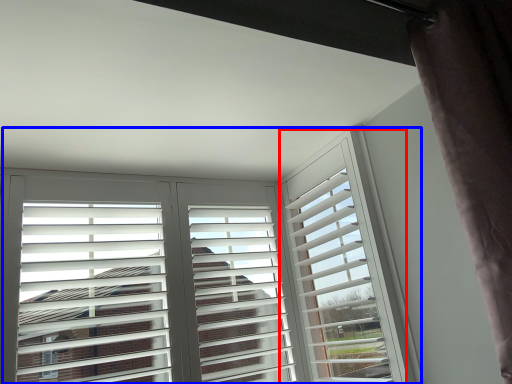
Question: Which object appears farthest to the camera in this image, window frame (highlighted by a red box) or window (highlighted by a blue box)?

Choices:
 (A) window frame
 (B) window

Answer: (A)